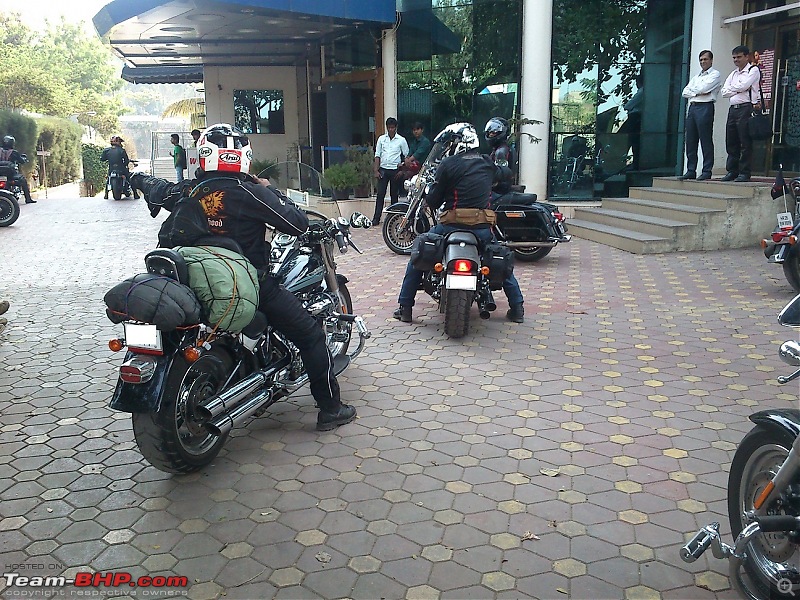
Find the location of `back light`. back light is located at coordinates (130, 365), (460, 265), (558, 216).